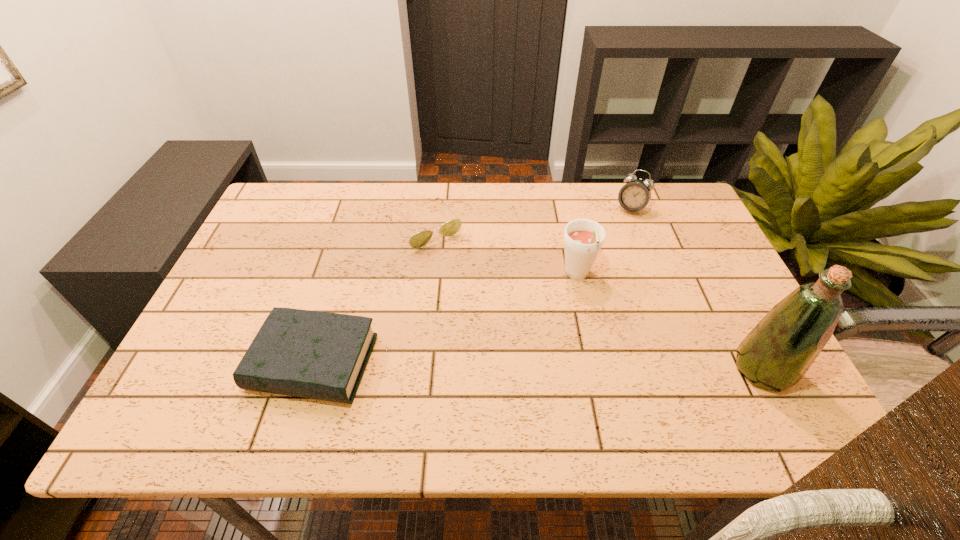
This screenshot has width=960, height=540. I want to click on vacant area situated 0.210m on the drink side of the third object from right to left, so click(584, 366).

Identify the location of vacant space located 0.270m on the drink side of the third object from right to left. The image size is (960, 540). (585, 389).

Locate an element on the screen. vacant space located 0.180m on the front-facing side of the shortest object is located at coordinates (475, 288).

Image resolution: width=960 pixels, height=540 pixels. Find the location of `vacant space located 0.310m on the front-facing side of the shortest object`. vacant space located 0.310m on the front-facing side of the shortest object is located at coordinates (503, 322).

Where is `free space located 0.400m on the front-facing side of the shortest object`? The width and height of the screenshot is (960, 540). free space located 0.400m on the front-facing side of the shortest object is located at coordinates (524, 348).

At what (x,y) coordinates should I click in order to perform the action: click on vacant space located 0.160m on the face of the alarm clock. Please return your answer as a coordinate pair (x, y). This screenshot has width=960, height=540. Looking at the image, I should click on (610, 247).

The image size is (960, 540). I want to click on vacant area situated 0.380m on the face of the alarm clock, so click(582, 298).

The width and height of the screenshot is (960, 540). Find the location of `blank area located on the face of the alarm clock`. blank area located on the face of the alarm clock is located at coordinates (582, 298).

The image size is (960, 540). I want to click on sunglasses present at the far edge, so click(x=419, y=240).

Identify the location of alarm clock that is at the far edge. (634, 196).